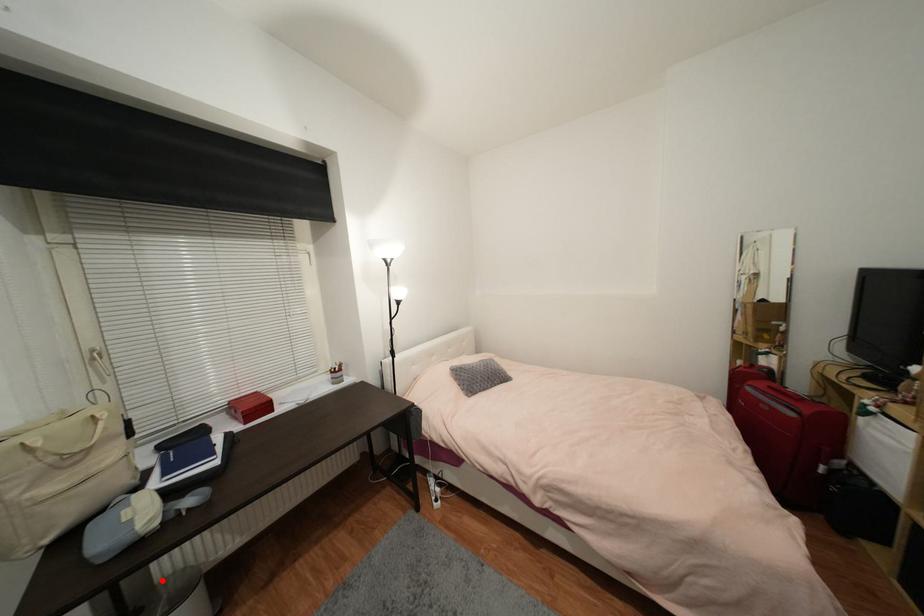
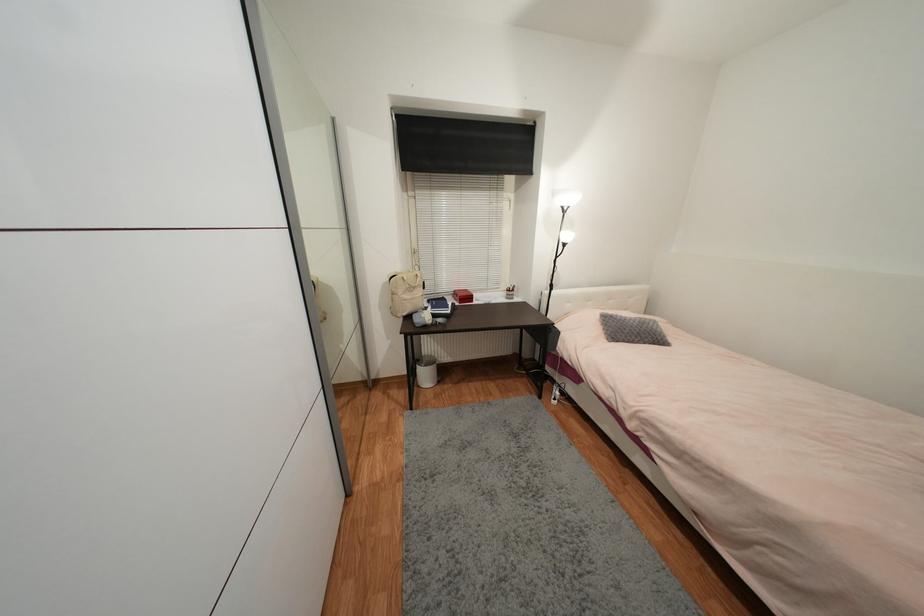
Find the pixel in the second image that matches the highlighted location in the first image.

(428, 355)